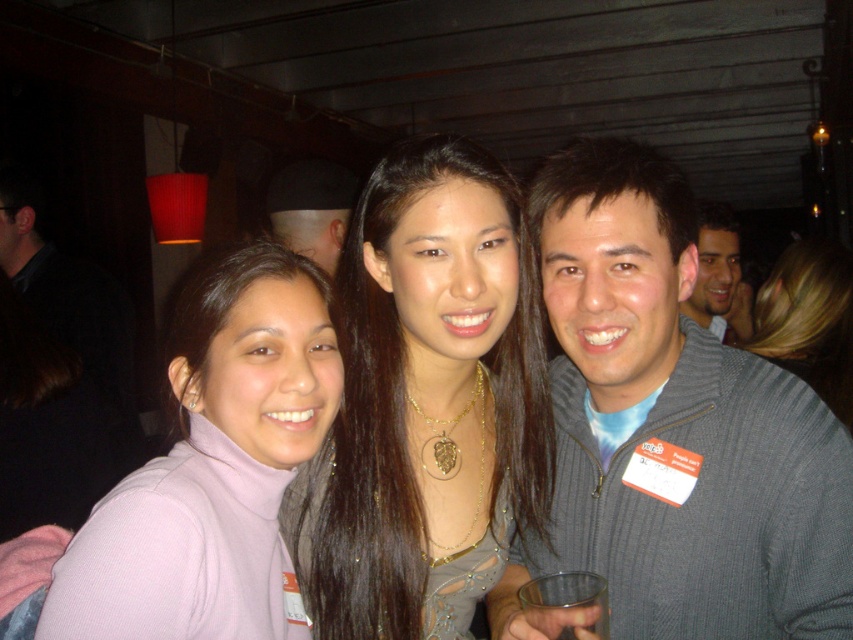
Which of these two, matte gold necklace at center or shiny black hat at upper center, stands shorter?

shiny black hat at upper center

Can you confirm if matte gold necklace at center is thinner than shiny black hat at upper center?

Indeed, matte gold necklace at center has a lesser width compared to shiny black hat at upper center.

Who is more distant from viewer, (x=352, y=545) or (x=299, y=198)?

The point (x=299, y=198) is behind.

Identify the location of matte gold necklace at center. (427, 403).

Image resolution: width=853 pixels, height=640 pixels. Describe the element at coordinates (213, 467) in the screenshot. I see `pink turtleneck sweater at center` at that location.

Is point (312, 339) farther from viewer compared to point (309, 173)?

That is False.

Is point (183, 541) positioned before point (344, 220)?

Yes, point (183, 541) is closer to viewer.

At what (x,y) coordinates should I click in order to perform the action: click on pink turtleneck sweater at center. Please return your answer as a coordinate pair (x, y). This screenshot has height=640, width=853. Looking at the image, I should click on (213, 467).

Is shiny gold necklace at center above transparent glass cup at lower center?

Indeed, shiny gold necklace at center is positioned over transparent glass cup at lower center.

Can you confirm if shiny gold necklace at center is smaller than transparent glass cup at lower center?

No, shiny gold necklace at center is not smaller than transparent glass cup at lower center.

The width and height of the screenshot is (853, 640). I want to click on shiny gold necklace at center, so click(809, 320).

Locate an element on the screen. This screenshot has height=640, width=853. shiny gold necklace at center is located at coordinates (809, 320).